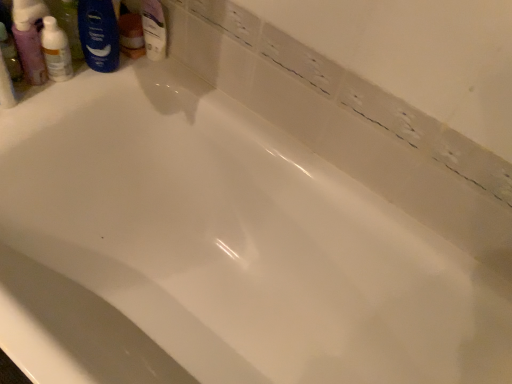
In order to click on free spot to the right of blue matte shaving cream at upper left in this screenshot , I will do `click(156, 71)`.